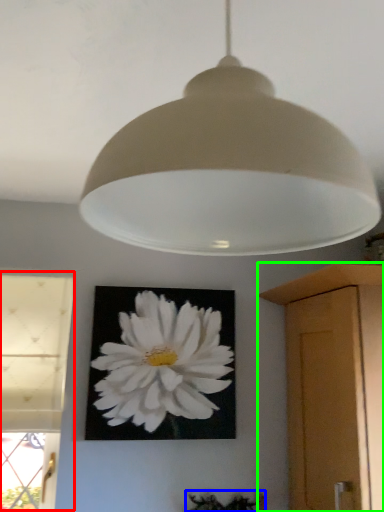
Question: Based on their relative distances, which object is nearer to window (highlighted by a red box)? Choose from plant (highlighted by a blue box) and cabinetry (highlighted by a green box).

Choices:
 (A) plant
 (B) cabinetry

Answer: (A)